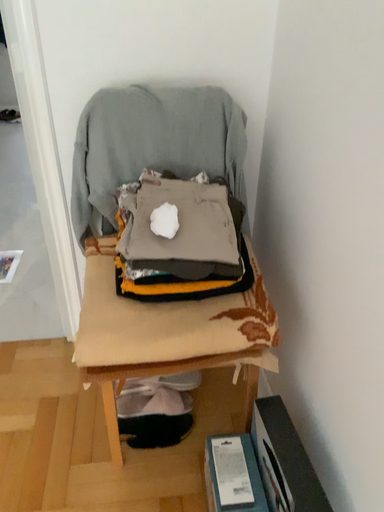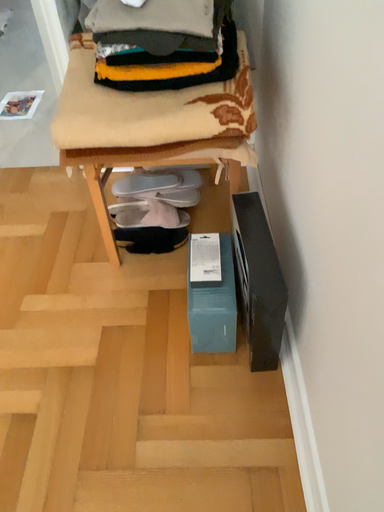
Question: How did the camera likely rotate when shooting the video?

Choices:
 (A) rotated left
 (B) rotated right

Answer: (A)